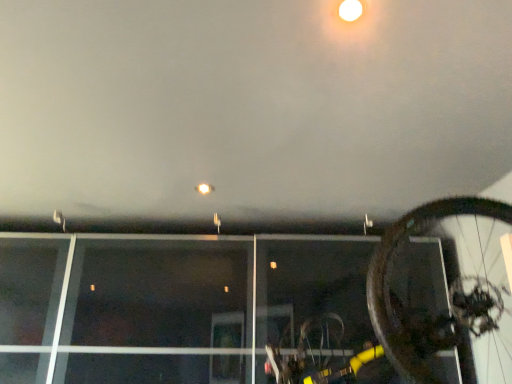
Question: Should I look upward or downward to see shiny metallic bicycle wheel at right?

Choices:
 (A) down
 (B) up

Answer: (A)

Question: Does matte white droplight at upper center come in front of shiny metallic bicycle wheel at right?

Choices:
 (A) no
 (B) yes

Answer: (A)

Question: From a real-world perspective, does matte white droplight at upper center stand above shiny metallic bicycle wheel at right?

Choices:
 (A) yes
 (B) no

Answer: (A)

Question: Is matte white droplight at upper center positioned with its back to shiny metallic bicycle wheel at right?

Choices:
 (A) no
 (B) yes

Answer: (A)

Question: Considering the relative sizes of matte white droplight at upper center and shiny metallic bicycle wheel at right in the image provided, is matte white droplight at upper center shorter than shiny metallic bicycle wheel at right?

Choices:
 (A) no
 (B) yes

Answer: (B)

Question: Does matte white droplight at upper center have a greater height compared to shiny metallic bicycle wheel at right?

Choices:
 (A) no
 (B) yes

Answer: (A)

Question: Can you confirm if matte white droplight at upper center is positioned to the right of shiny metallic bicycle wheel at right?

Choices:
 (A) yes
 (B) no

Answer: (B)

Question: From a real-world perspective, is shiny metallic bicycle wheel at right positioned over matte white droplight at upper center based on gravity?

Choices:
 (A) no
 (B) yes

Answer: (A)

Question: Can you confirm if shiny metallic bicycle wheel at right is taller than matte white droplight at upper center?

Choices:
 (A) yes
 (B) no

Answer: (A)

Question: Is shiny metallic bicycle wheel at right shorter than matte white droplight at upper center?

Choices:
 (A) no
 (B) yes

Answer: (A)

Question: From the image's perspective, does shiny metallic bicycle wheel at right appear higher than matte white droplight at upper center?

Choices:
 (A) no
 (B) yes

Answer: (A)

Question: Are shiny metallic bicycle wheel at right and matte white droplight at upper center located far from each other?

Choices:
 (A) no
 (B) yes

Answer: (B)

Question: Is the depth of shiny metallic bicycle wheel at right greater than that of matte white droplight at upper center?

Choices:
 (A) yes
 (B) no

Answer: (B)

Question: From a real-world perspective, is shiny metallic bicycle wheel at right positioned above or below matte white droplight at upper center?

Choices:
 (A) above
 (B) below

Answer: (B)